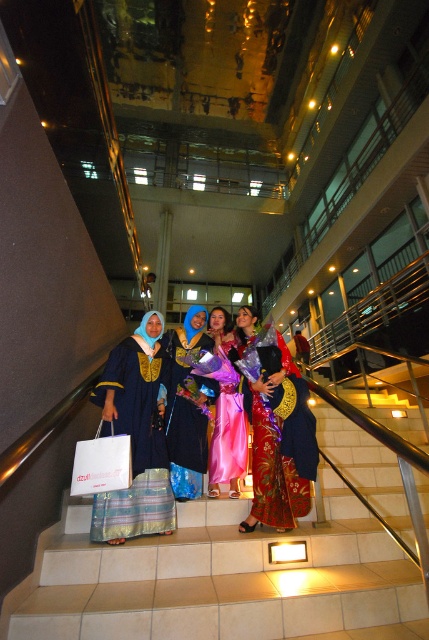
Who is positioned more to the left, silk floral dress at center or silky pink dress at center?

silky pink dress at center is more to the left.

Where is `silk floral dress at center`? This screenshot has height=640, width=429. silk floral dress at center is located at coordinates (272, 452).

Where is `silk floral dress at center`? The image size is (429, 640). silk floral dress at center is located at coordinates (272, 452).

Measure the distance between silky blue dress at center and camera.

2.88 meters

Is silky blue dress at center above silky pink dress at center?

No, silky blue dress at center is not above silky pink dress at center.

Which is in front, point (175, 364) or point (226, 326)?

Point (175, 364) is more forward.

The image size is (429, 640). I want to click on silky blue dress at center, so click(x=187, y=410).

Is silky satin dress at center smaller than silk floral dress at center?

No.

You are a GUI agent. You are given a task and a screenshot of the screen. Output one action in this format:
    pyautogui.click(x=<x>, y=<y>)
    Task: Click on the silky satin dress at center
    
    Given the screenshot: What is the action you would take?
    pyautogui.click(x=224, y=579)

This screenshot has height=640, width=429. I want to click on silky satin dress at center, so click(x=224, y=579).